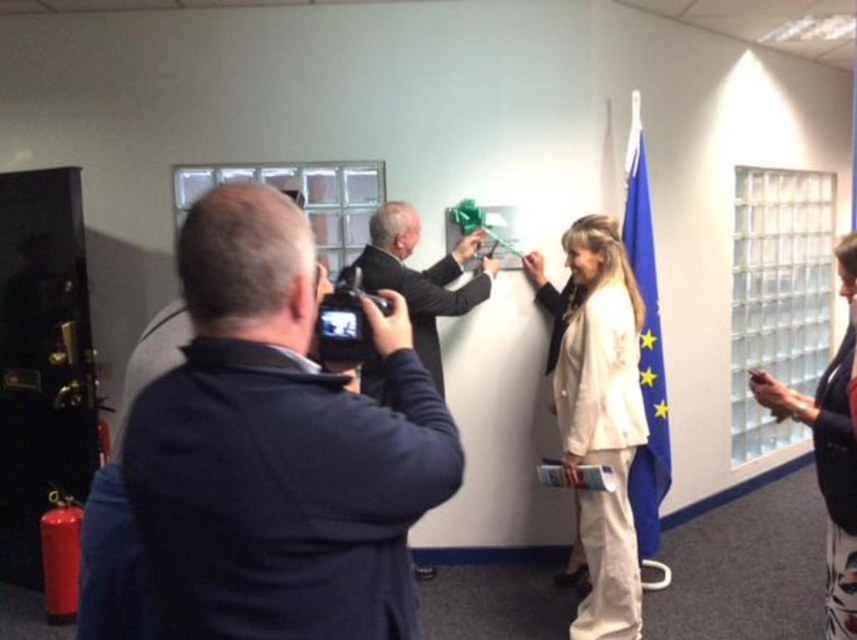
You are attending a ribbon cutting ceremony and notice two items of blue color. The dark blue sweater at center and the blue fabric flag at right. Which one is closer to the front of the scene?

The dark blue sweater at center is positioned under the blue fabric flag at right, meaning the sweater is closer to the front of the scene since it is lower in the image.

You are attending a ribbon cutting ceremony and see two people in dark blue sweater at center and dark suit jacket at center. Which one is lower in position?

The dark blue sweater at center is below dark suit jacket at center, so the dark blue sweater at center is lower in position.